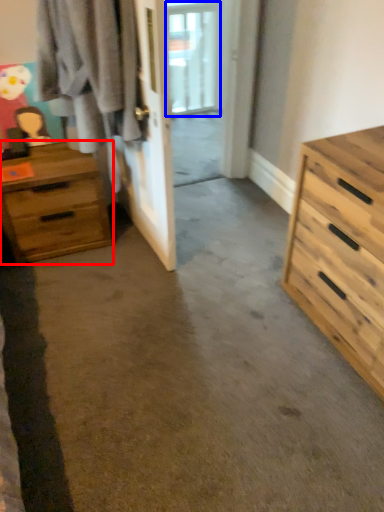
Question: Which object is further to the camera taking this photo, chest of drawers (highlighted by a red box) or window (highlighted by a blue box)?

Choices:
 (A) chest of drawers
 (B) window

Answer: (B)